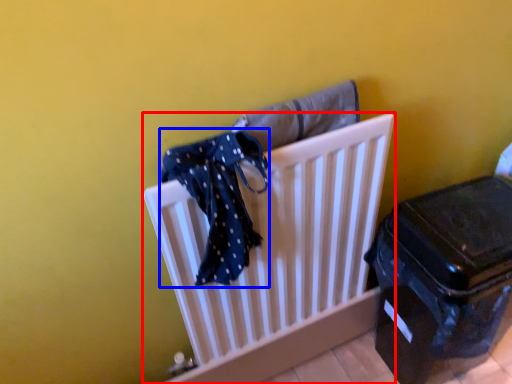
Question: Which point is closer to the camera, furniture (highlighted by a red box) or scarf (highlighted by a blue box)?

Choices:
 (A) furniture
 (B) scarf

Answer: (B)